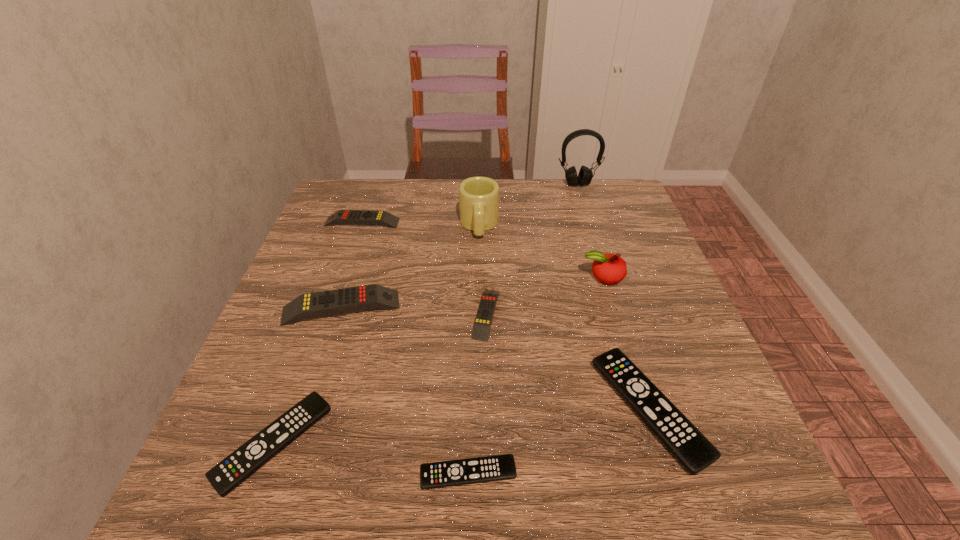
At what (x,y) coordinates should I click in order to perform the action: click on vacant space located 0.090m on the right of the second biggest yellow remote control. Please return your answer as a coordinate pair (x, y). Looking at the image, I should click on (433, 222).

I want to click on vacant area situated on the back of the rightmost remote control, so click(607, 277).

The image size is (960, 540). In order to click on blank space located 0.100m on the back of the smallest yellow remote control in this screenshot , I will do click(x=486, y=260).

Where is `free region located 0.360m on the right of the leftmost black remote control`? free region located 0.360m on the right of the leftmost black remote control is located at coordinates (548, 443).

You are a GUI agent. You are given a task and a screenshot of the screen. Output one action in this format:
    pyautogui.click(x=<x>, y=<y>)
    Task: Click on the free space located 0.180m on the back of the second black remote control from right to left
    The image size is (960, 540).
    Given the screenshot: What is the action you would take?
    pyautogui.click(x=470, y=363)

What are the coordinates of `headset situated at the far edge` in the screenshot? It's located at (585, 175).

At what (x,y) coordinates should I click in order to perform the action: click on mug at the far edge. Please return your answer as a coordinate pair (x, y). The height and width of the screenshot is (540, 960). Looking at the image, I should click on (478, 196).

At what (x,y) coordinates should I click in order to perform the action: click on remote control that is at the far edge. Please return your answer as a coordinate pair (x, y). Looking at the image, I should click on (357, 217).

Image resolution: width=960 pixels, height=540 pixels. In order to click on headset positioned at the right edge in this screenshot , I will do `click(585, 175)`.

You are a GUI agent. You are given a task and a screenshot of the screen. Output one action in this format:
    pyautogui.click(x=<x>, y=<y>)
    Task: Click on the apple that is at the right edge
    The width and height of the screenshot is (960, 540).
    Given the screenshot: What is the action you would take?
    pyautogui.click(x=608, y=268)